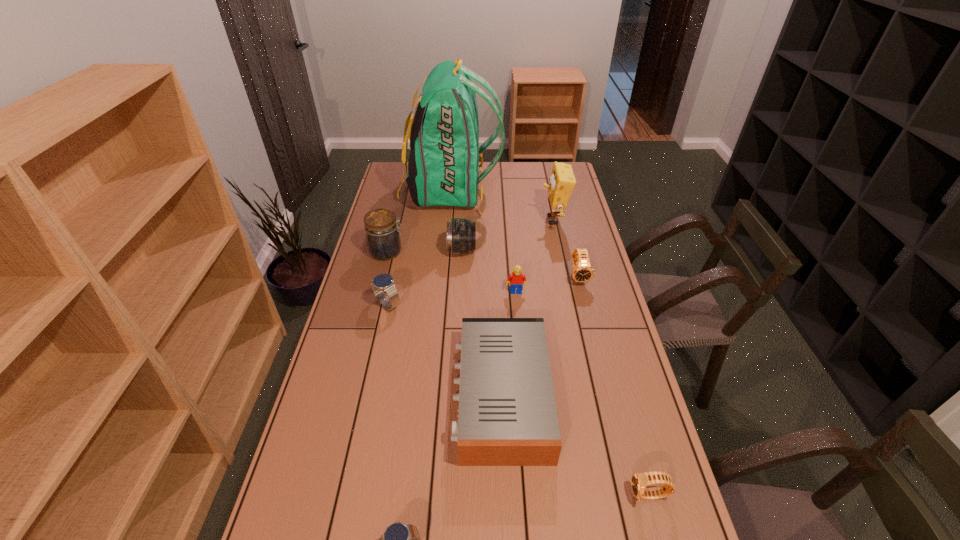
Find the location of `free point between the farthest watch and the backpack`. free point between the farthest watch and the backpack is located at coordinates (515, 234).

Find the location of `vacant area that lies between the left blue watch and the backpack`. vacant area that lies between the left blue watch and the backpack is located at coordinates (420, 248).

This screenshot has height=540, width=960. Find the location of `free spot between the leftmost watch and the farthest watch`. free spot between the leftmost watch and the farthest watch is located at coordinates point(483,291).

The image size is (960, 540). In order to click on free space between the farther blue watch and the farthest watch in this screenshot , I will do `click(483, 291)`.

Locate an element on the screen. This screenshot has width=960, height=540. object that stands as the second closest to the backpack is located at coordinates (460, 233).

Locate which object ranks in proximity to the nearer black watch. Please provide its 2D coordinates. Your answer should be formatted as a tuple, i.e. [(x, y)], where the tuple contains the x and y coordinates of a point satisfying the conditions above.

[(507, 416)]

Where is `watch object that ranks as the fourth closest to the third nearest object`? The height and width of the screenshot is (540, 960). watch object that ranks as the fourth closest to the third nearest object is located at coordinates (582, 271).

Choose which watch is the nearest neighbor to the bigger blue watch. Please provide its 2D coordinates. Your answer should be formatted as a tuple, i.e. [(x, y)], where the tuple contains the x and y coordinates of a point satisfying the conditions above.

[(582, 271)]